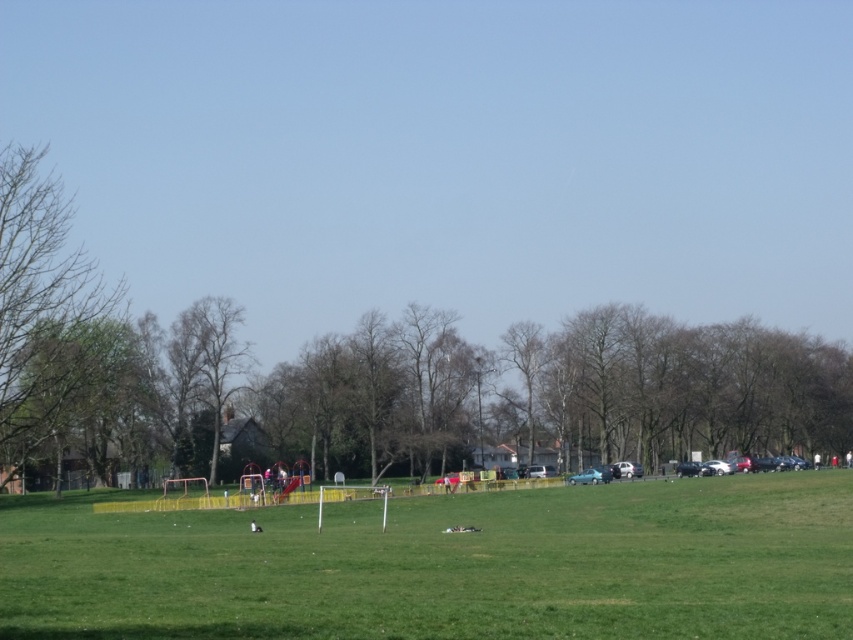
You are standing at the center of the park and want to find the green leafy tree at left. According to the park layout, where would you look relative to your position?

The green leafy tree at left is located at the point with coordinates 0.487 on the x axis and 0.054 on the y axis relative to the park layout.

You are planning to set up a picnic blanket in the park. The picnic blanket is 2 meters wide. You have two options for locations in the image provided. One is the green grassy field at center and the other is the green leafy tree at left. Which location would provide enough space for your picnic blanket without overlapping with the tree?

The green grassy field at center has a larger size compared to the green leafy tree at left, so the green grassy field at center would provide enough space for the picnic blanket without overlapping with the tree.

Looking at this image, you are planning to plant a new tree in the park. The green leafy tree at left and the brown wood tree at center are already present. Which tree is shorter and should be considered for spacing when planting the new tree?

The green leafy tree at left is shorter than the brown wood tree at center, so it should be considered for spacing when planting the new tree.